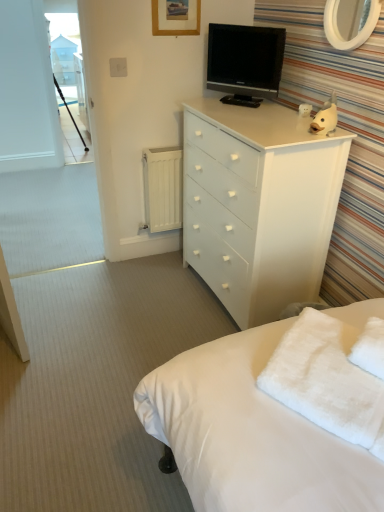
Question: From the image's perspective, is white fluffy towel at lower right positioned above or below white glossy chest of drawers at upper right?

Choices:
 (A) above
 (B) below

Answer: (B)

Question: Does point (306, 382) appear closer or farther from the camera than point (243, 302)?

Choices:
 (A) closer
 (B) farther

Answer: (A)

Question: Based on their relative distances, which object is farther from the white matte fish at upper right?

Choices:
 (A) black glossy tv at upper center
 (B) white painted metal radiator at lower left
 (C) white glossy mirror at upper right
 (D) white glossy chest of drawers at upper right
 (E) wooden picture frame at upper center

Answer: (B)

Question: Which is nearer to the white fluffy towel at lower right?

Choices:
 (A) white matte fish at upper right
 (B) black glossy tv at upper center
 (C) white glossy chest of drawers at upper right
 (D) transparent glass window screen at upper left
 (E) white painted metal radiator at lower left

Answer: (C)